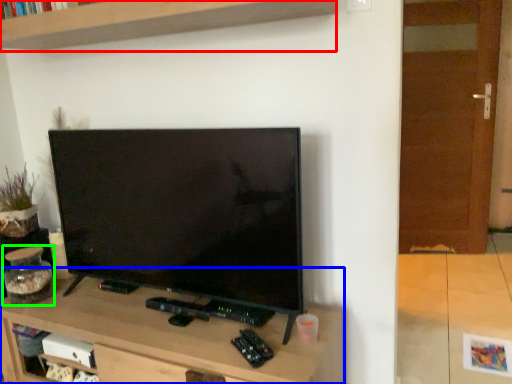
Question: Based on their relative distances, which object is nearer to shelf (highlighted by a red box)? Choose from table (highlighted by a blue box) and glass jar (highlighted by a green box).

Choices:
 (A) table
 (B) glass jar

Answer: (B)